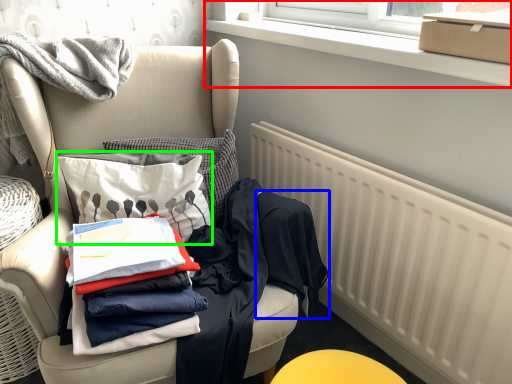
Question: Which object is positioned closest to window frame (highlighted by a red box)? Select from clothing (highlighted by a blue box) and throw pillow (highlighted by a green box).

Choices:
 (A) clothing
 (B) throw pillow

Answer: (A)